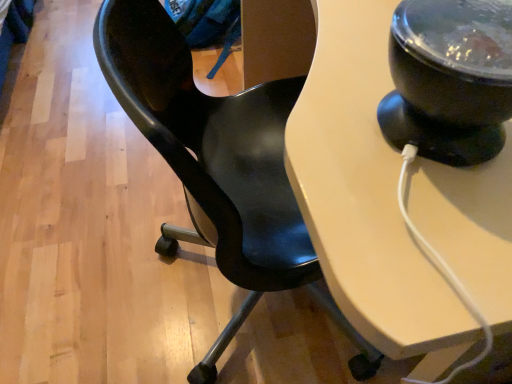
Where is `black plastic chair at center`? black plastic chair at center is located at coordinates (218, 165).

Image resolution: width=512 pixels, height=384 pixels. What do you see at coordinates (218, 165) in the screenshot?
I see `black plastic chair at center` at bounding box center [218, 165].

Locate an element on the screen. black plastic chair at center is located at coordinates (218, 165).